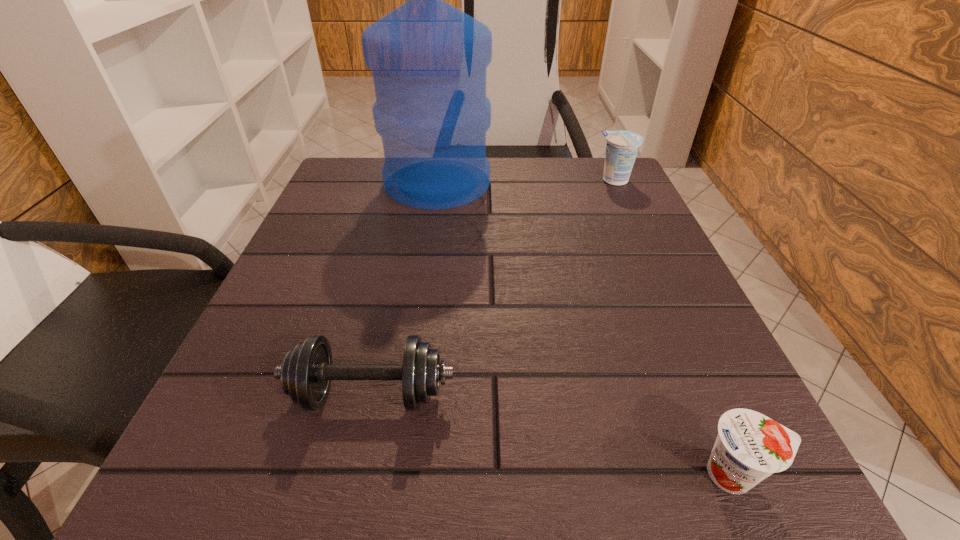
Find the location of a particular element. The width and height of the screenshot is (960, 540). free spot between the second nearest object and the tallest object is located at coordinates point(404,288).

Identify the location of empty space that is in between the nearest object and the dumbbell. (552, 434).

Locate which object is the third closest to the second nearest object. Please provide its 2D coordinates. Your answer should be formatted as a tuple, i.e. [(x, y)], where the tuple contains the x and y coordinates of a point satisfying the conditions above.

[(622, 147)]

Locate an element on the screen. The width and height of the screenshot is (960, 540). object that is the closest one to the taller yogurt is located at coordinates (429, 60).

Find the location of a particular element. This screenshot has width=960, height=540. free space that satisfies the following two spatial constraints: 1. on the back side of the water jug; 2. on the left side of the second nearest object is located at coordinates (417, 183).